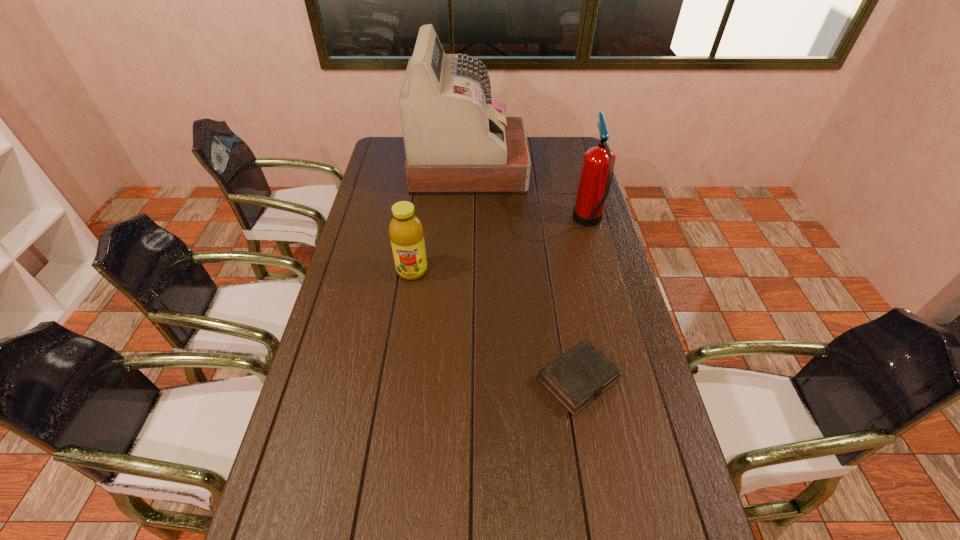
At what (x,y) coordinates should I click in order to perform the action: click on blank space that satisfies the following two spatial constraints: 1. on the operating side of the tallest object; 2. on the back side of the shortest object. Please return your answer as a coordinate pair (x, y). This screenshot has height=540, width=960. Looking at the image, I should click on (462, 380).

Where is `vacant space that satisfies the following two spatial constraints: 1. on the operating side of the farthest object; 2. on the left side of the shortest object`? The width and height of the screenshot is (960, 540). vacant space that satisfies the following two spatial constraints: 1. on the operating side of the farthest object; 2. on the left side of the shortest object is located at coordinates (462, 380).

Locate an element on the screen. free space that satisfies the following two spatial constraints: 1. on the operating side of the cash register; 2. on the front label of the third farthest object is located at coordinates tap(466, 271).

You are a GUI agent. You are given a task and a screenshot of the screen. Output one action in this format:
    pyautogui.click(x=<x>, y=<y>)
    Task: Click on the blank area in the image that satisfies the following two spatial constraints: 1. on the operating side of the farthest object; 2. on the left side of the fire extinguisher
    Image resolution: width=960 pixels, height=540 pixels.
    Given the screenshot: What is the action you would take?
    pyautogui.click(x=467, y=222)

You are a GUI agent. You are given a task and a screenshot of the screen. Output one action in this format:
    pyautogui.click(x=<x>, y=<y>)
    Task: Click on the free space in the image that satisfies the following two spatial constraints: 1. on the operating side of the farthest object; 2. on the front label of the second nearest object
    The height and width of the screenshot is (540, 960).
    Given the screenshot: What is the action you would take?
    pyautogui.click(x=466, y=271)

Locate an element on the screen. The width and height of the screenshot is (960, 540). vacant space that satisfies the following two spatial constraints: 1. on the operating side of the cash register; 2. on the front label of the second nearest object is located at coordinates (466, 271).

The height and width of the screenshot is (540, 960). I want to click on vacant space that satisfies the following two spatial constraints: 1. on the operating side of the tallest object; 2. on the front label of the third tallest object, so click(x=466, y=271).

What are the coordinates of `free space that satisfies the following two spatial constraints: 1. on the operating side of the farthest object; 2. on the right side of the nearest object` in the screenshot? It's located at (462, 380).

I want to click on vacant region that satisfies the following two spatial constraints: 1. on the operating side of the tallest object; 2. on the back side of the shortest object, so click(x=462, y=380).